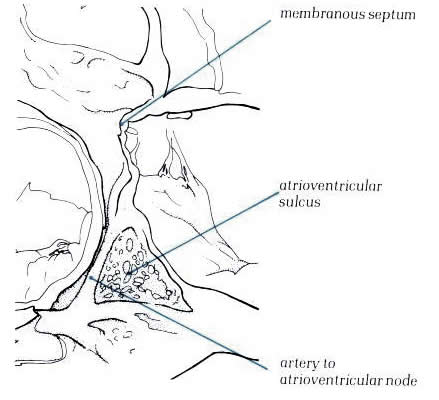
The image size is (439, 400). Identify the location of passage. (100, 188).